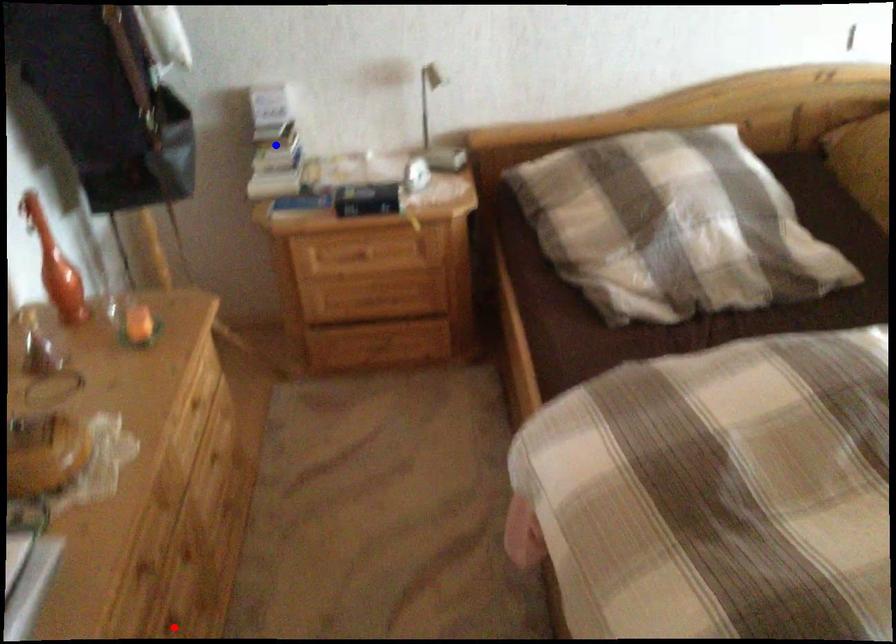
Question: Two points are marked on the image. Which point is closer to the camera?

Choices:
 (A) Blue point is closer.
 (B) Red point is closer.

Answer: (B)